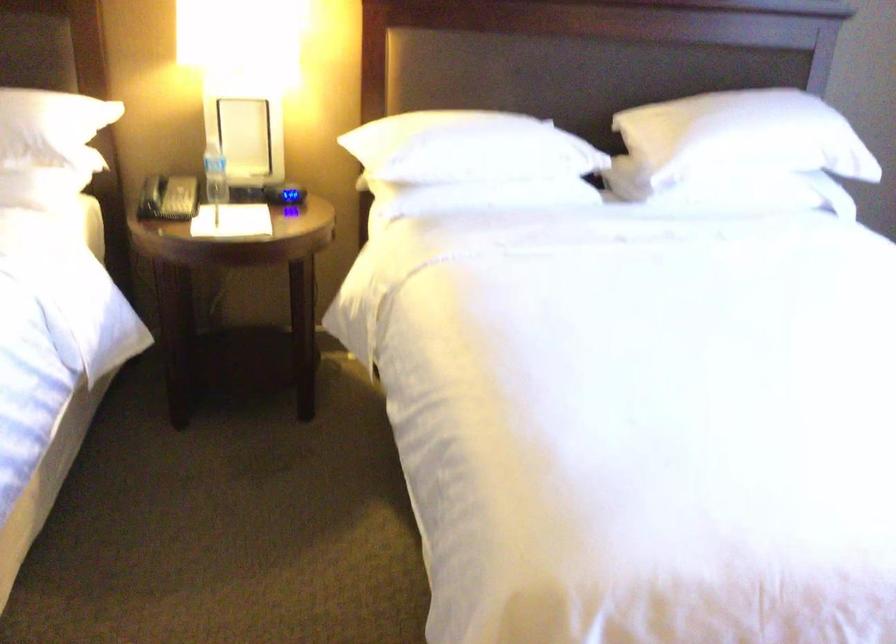
The image size is (896, 644). In order to click on telephone handset in this screenshot , I will do `click(152, 190)`.